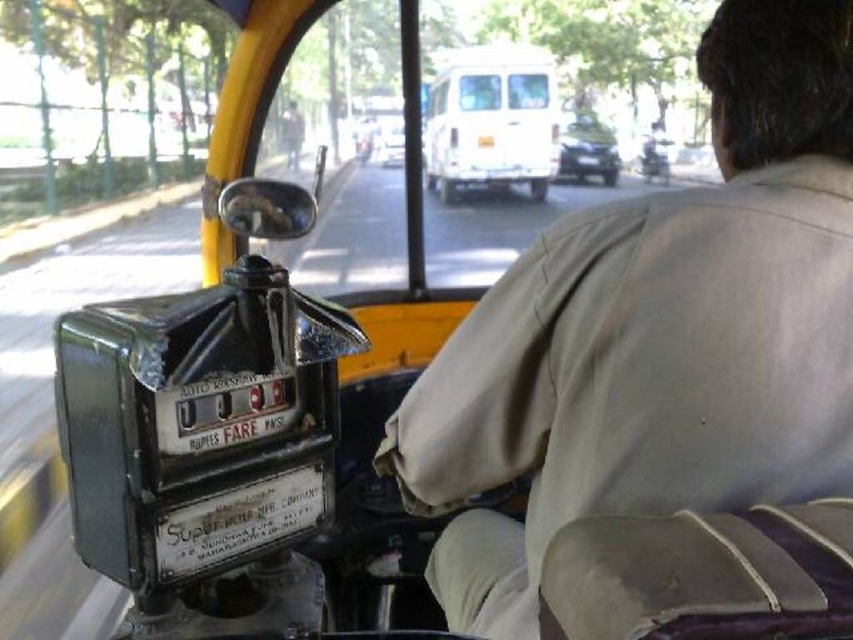
Question: Which object is closer to the camera taking this photo?

Choices:
 (A) shiny metallic motorcycle at center
 (B) metallic silver car at center
 (C) white matte bus at center

Answer: (C)

Question: Does beige fabric shirt at upper right appear on the right side of white plastic van at center?

Choices:
 (A) yes
 (B) no

Answer: (A)

Question: Does beige fabric shirt at upper right appear on the left side of white plastic van at center?

Choices:
 (A) no
 (B) yes

Answer: (A)

Question: From the image, what is the correct spatial relationship of beige fabric shirt at upper right in relation to shiny metallic motorcycle at center?

Choices:
 (A) left
 (B) right

Answer: (A)

Question: Which point is closer to the camera?

Choices:
 (A) beige fabric shirt at upper right
 (B) white plastic van at center
 (C) shiny metallic motorcycle at center

Answer: (A)

Question: Which object is closer to the camera taking this photo?

Choices:
 (A) white plastic van at center
 (B) metallic silver car at center
 (C) white matte bus at center
 (D) shiny metallic motorcycle at center

Answer: (C)